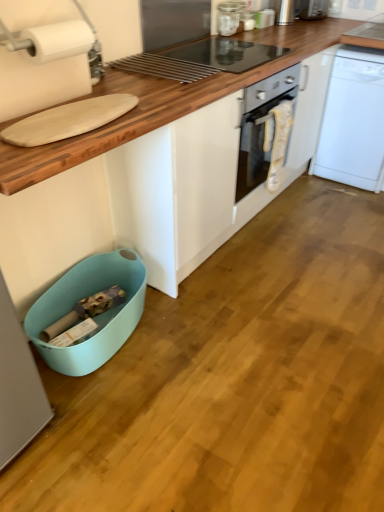
Find the location of `vacant region in front of metallic silver toaster at upper center, the 3th appliance when ordered from left to right`. vacant region in front of metallic silver toaster at upper center, the 3th appliance when ordered from left to right is located at coordinates (269, 33).